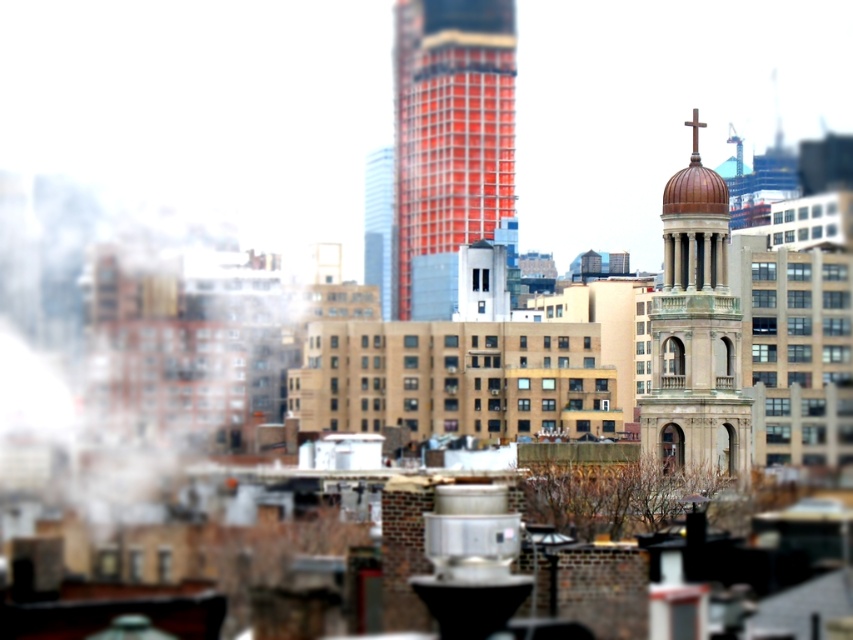
You are a drone operator who needs to fly a drone from your current position to the red glass skyscraper at center. According to the scene description, what is the approximate distance you need to cover?

The distance of red glass skyscraper at center from viewer is 644.62 meters, so the drone needs to cover approximately 644.62 meters to reach the red glass skyscraper at center.

You are a drone operator trying to navigate between the red glass skyscraper at center and the bronze domed tower at center right. Which structure should you fly over first to stay closer to the foreground?

You should fly over the red glass skyscraper at center first because it is closer to the foreground than the bronze domed tower at center right, so staying near it keeps you closer to the foreground.